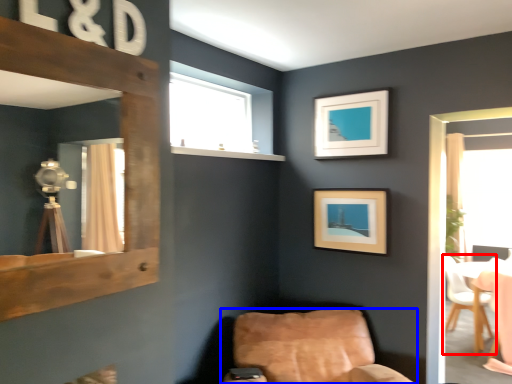
Question: Which object appears closest to the camera in this image, chair (highlighted by a red box) or chair (highlighted by a blue box)?

Choices:
 (A) chair
 (B) chair

Answer: (B)